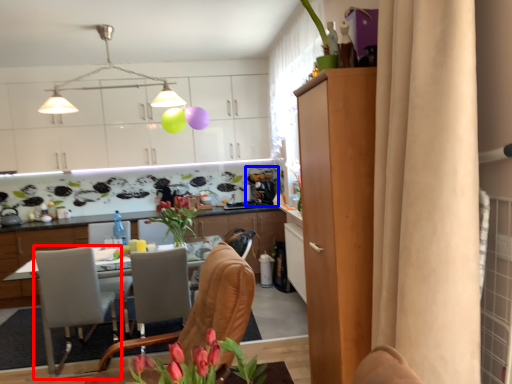
Question: Which of the following is the farthest to the observer, chair (highlighted by a red box) or coffee machine (highlighted by a blue box)?

Choices:
 (A) chair
 (B) coffee machine

Answer: (B)